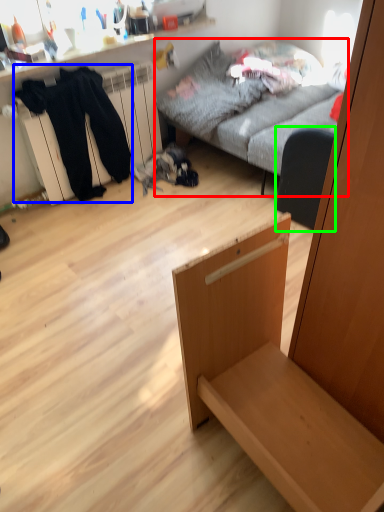
Question: Which object is the closest to the studio couch (highlighted by a red box)? Choose among these: clothing (highlighted by a blue box) or armchair (highlighted by a green box).

Choices:
 (A) clothing
 (B) armchair

Answer: (B)